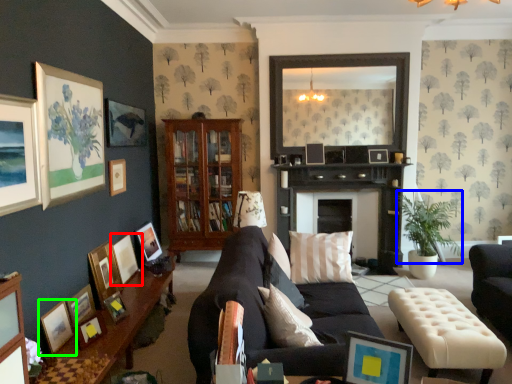
Question: Considering the real-world distances, which object is closest to picture frame (highlighted by a red box)? plant (highlighted by a blue box) or picture frame (highlighted by a green box).

Choices:
 (A) plant
 (B) picture frame

Answer: (B)